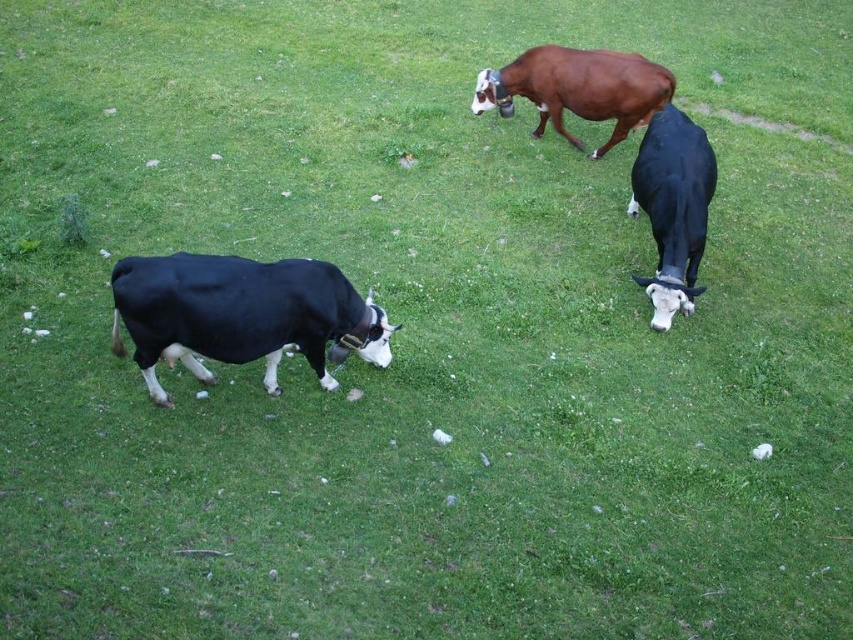
Question: Can you confirm if black smooth cow at left is positioned above brown glossy cow at upper center?

Choices:
 (A) no
 (B) yes

Answer: (A)

Question: Does black smooth cow at left lie behind brown glossy cow at upper center?

Choices:
 (A) yes
 (B) no

Answer: (B)

Question: Estimate the real-world distances between objects in this image. Which object is closer to the brown glossy cow at upper center?

Choices:
 (A) black smooth cow at left
 (B) black glossy cow at right

Answer: (B)

Question: Does black glossy cow at right appear over brown glossy cow at upper center?

Choices:
 (A) no
 (B) yes

Answer: (A)

Question: Which object appears closest to the camera in this image?

Choices:
 (A) brown glossy cow at upper center
 (B) black smooth cow at left
 (C) black glossy cow at right

Answer: (B)

Question: Estimate the real-world distances between objects in this image. Which object is closer to the brown glossy cow at upper center?

Choices:
 (A) black smooth cow at left
 (B) black glossy cow at right

Answer: (B)